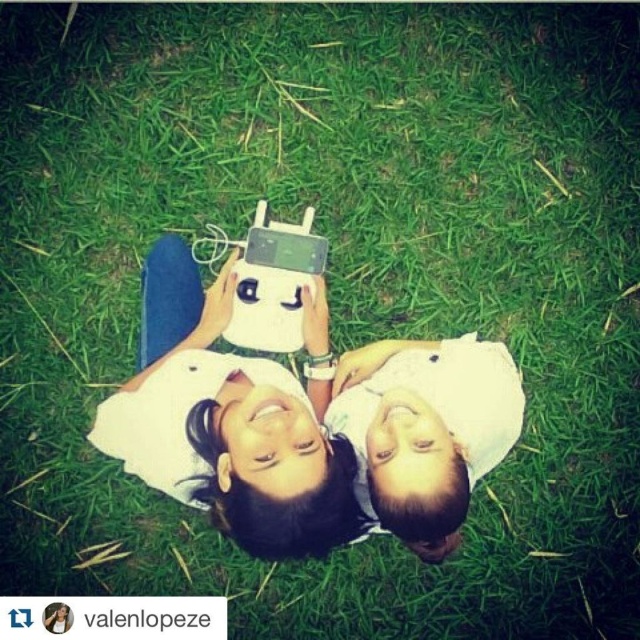
You are trying to take a selfie with your child in a park. You have a white matte phone at center and a white matte shirt at center. Which object is taller when looking at them from above?

The white matte phone at center is taller than the white matte shirt at center.

You are trying to take a selfie with your child in a park. You have a white matte phone at center and a white matte shirt at center. Which object is larger in the scene?

The white matte phone at center is bigger than the white matte shirt at center.

You are standing in the scene and want to take a photo of the two people using your camera. Which point, point (280, 371) or point (378, 380), would appear larger in the photo?

Point (280, 371) would appear larger in the photo because it is closer to the camera than point (378, 380).